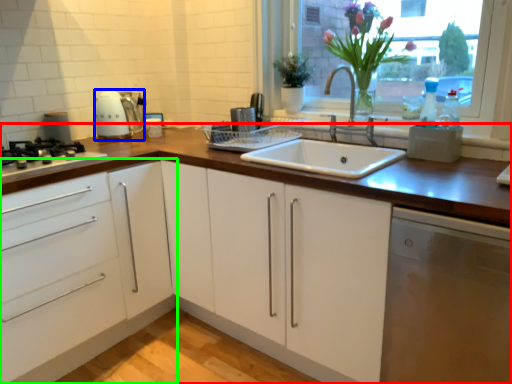
Question: Considering the real-world distances, which object is farthest from countertop (highlighted by a red box)? kitchen appliance (highlighted by a blue box) or cabinetry (highlighted by a green box)?

Choices:
 (A) kitchen appliance
 (B) cabinetry

Answer: (A)